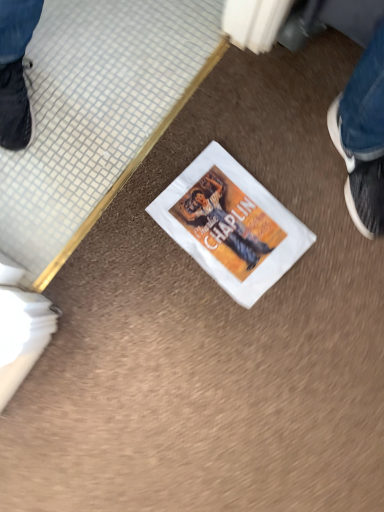
Describe the element at coordinates (231, 225) in the screenshot. This screenshot has height=512, width=384. I see `white paper comic book at center` at that location.

What is the approximate width of white paper comic book at center?

It is 11.78 inches.

In order to face white paper comic book at center, should I rotate leftwards or rightwards?

You should rotate right by 5.360 degrees.

Measure the distance between point (191, 224) and camera.

Point (191, 224) is 87.70 centimeters from camera.

Measure the distance between white paper comic book at center and camera.

They are 33.96 inches apart.

You are a GUI agent. You are given a task and a screenshot of the screen. Output one action in this format:
    pyautogui.click(x=<x>, y=<y>)
    Task: Click on the white paper comic book at center
    Image resolution: width=384 pixels, height=512 pixels.
    Given the screenshot: What is the action you would take?
    pyautogui.click(x=231, y=225)

Where is `white paper comic book at center`? The width and height of the screenshot is (384, 512). white paper comic book at center is located at coordinates (231, 225).